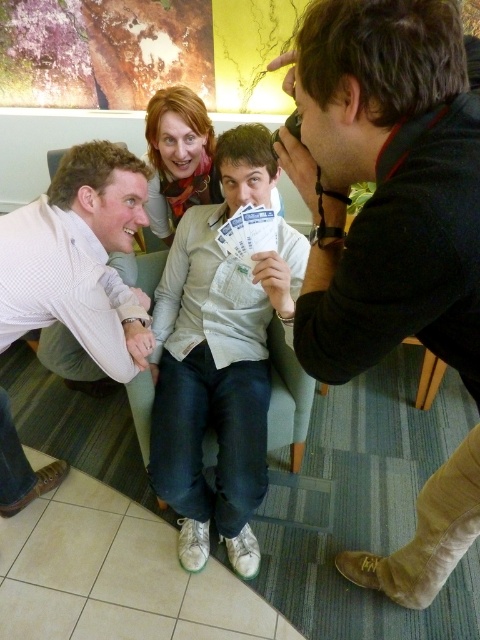
You are organizing a small event and need to place a 20 inch wide decorative item between the light beige sweater at center and the white paper cards at center. Can this item fit in the space between them?

The distance between the light beige sweater at center and the white paper cards at center is 24.10 inches. Since the decorative item is 20 inches wide, it can fit in the space between them as there is enough room.

You are organizing a small event and need to place a decorative ribbon between the light beige sweater at center and the white paper cards at center. Based on their positions, where should you place the ribbon to ensure it is between them?

The light beige sweater at center is positioned on the left side of white paper cards at center, so placing the ribbon to the right of the light beige sweater at center and to the left of the white paper cards at center would place it between them.

You are a photographer in the office scene. You need to adjust your camera focus to capture both the white dotted shirt at lower left and the light beige sweater at center. Which one should you focus on first to ensure the tallest object is in sharp focus?

The white dotted shirt at lower left is much taller than the light beige sweater at center, so you should focus on the white dotted shirt at lower left first to ensure the tallest object is in sharp focus.